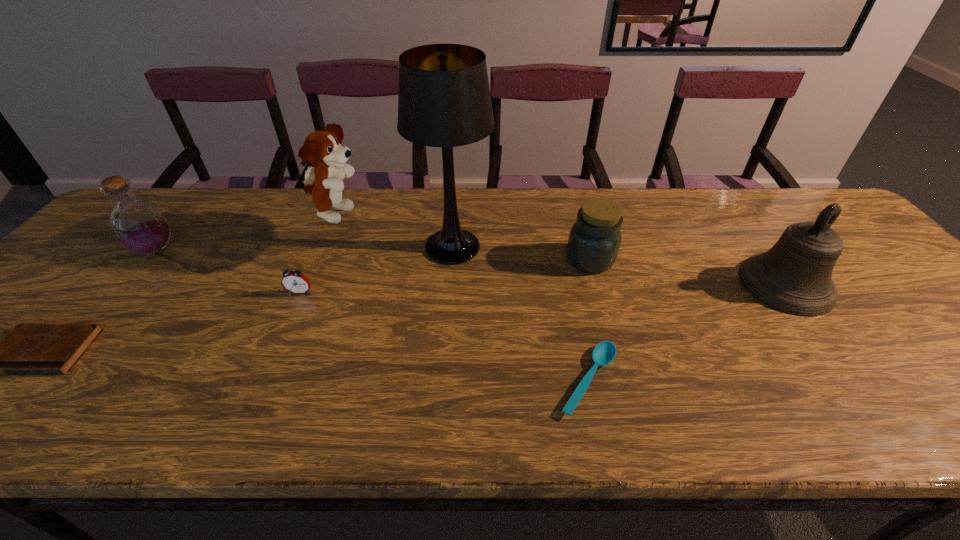
Find the location of a particular element. The width and height of the screenshot is (960, 540). the sixth closest object relative to the seventh tallest object is located at coordinates (594, 240).

Identify the location of object that stands as the fifth closest to the bottle. The height and width of the screenshot is (540, 960). (603, 354).

Where is `free space that satisfies the following two spatial constraints: 1. on the face of the puppy; 2. on the clock face of the alarm clock`? The image size is (960, 540). free space that satisfies the following two spatial constraints: 1. on the face of the puppy; 2. on the clock face of the alarm clock is located at coordinates (304, 293).

Where is `free location that satisfies the following two spatial constraints: 1. on the face of the puppy; 2. on the clock face of the alarm clock`? Image resolution: width=960 pixels, height=540 pixels. free location that satisfies the following two spatial constraints: 1. on the face of the puppy; 2. on the clock face of the alarm clock is located at coordinates (304, 293).

Where is `free spot that satisfies the following two spatial constraints: 1. on the face of the fourth object from right to left; 2. on the right side of the puppy`? free spot that satisfies the following two spatial constraints: 1. on the face of the fourth object from right to left; 2. on the right side of the puppy is located at coordinates (323, 247).